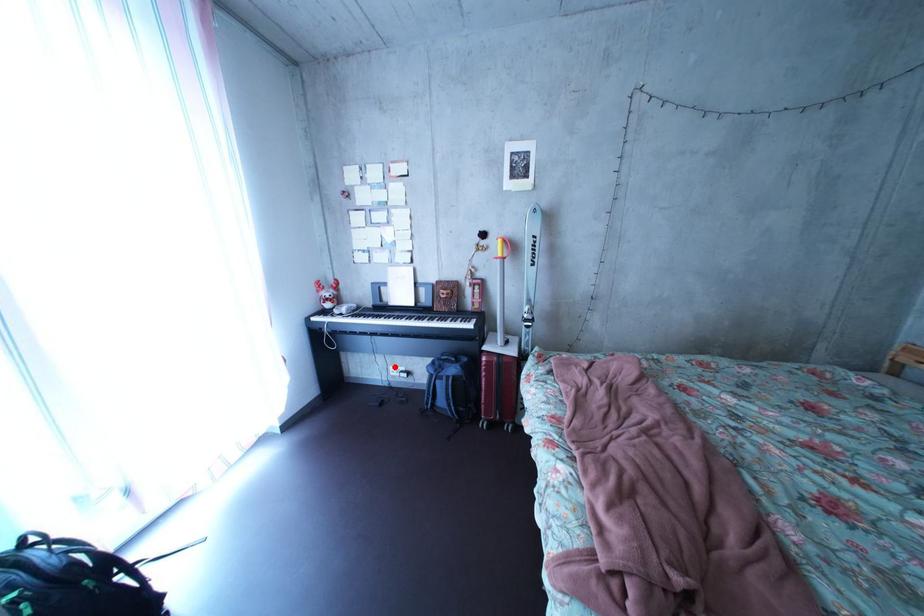
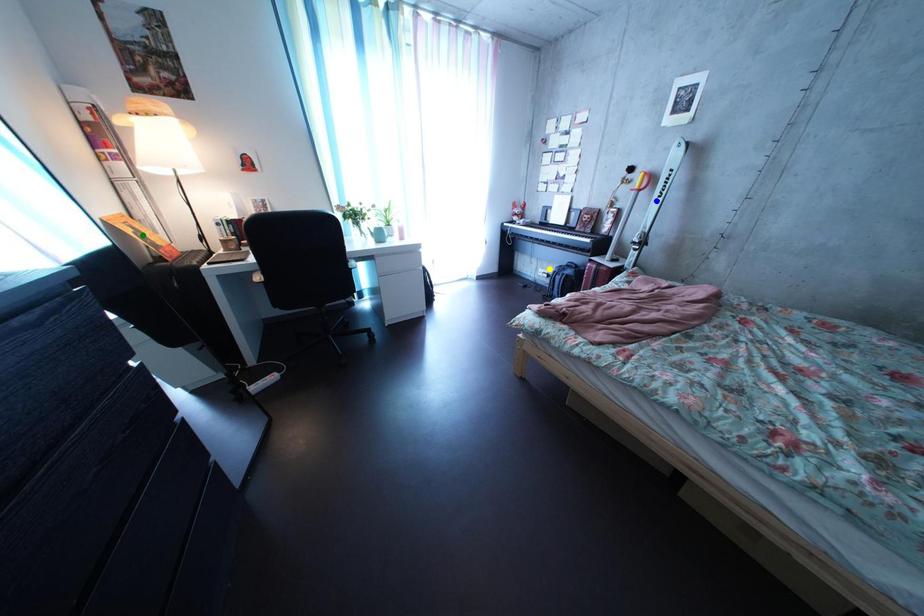
Question: I am providing you with two images of the same scene from different viewpoints. A red point is marked on the first image. You are given multiple points on the second image. Which spot in image 2 lines up with the point in image 1?

Choices:
 (A) green point
 (B) yellow point
 (C) blue point

Answer: (B)